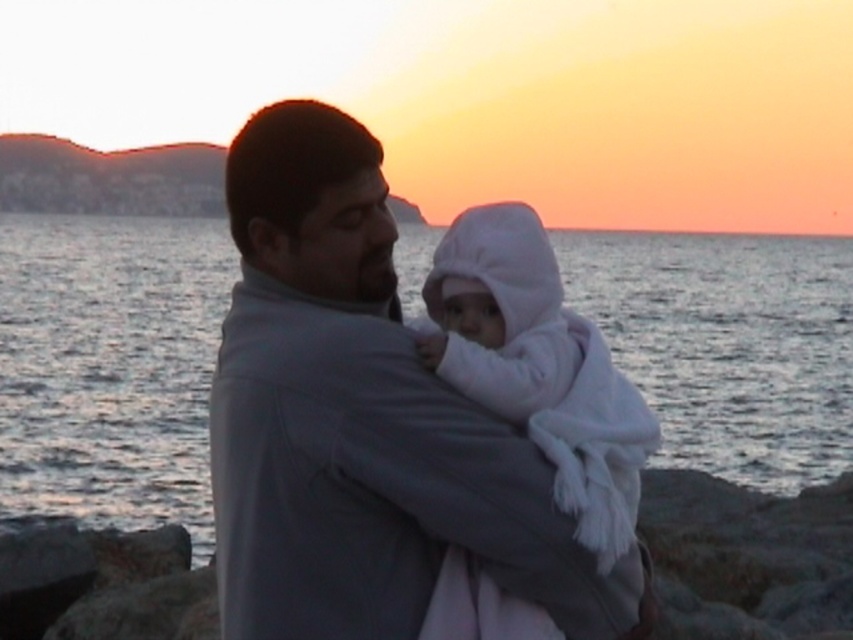
In order to click on gray fabric jacket at center in this screenshot , I will do `click(361, 420)`.

Looking at this image, is gray fabric jacket at center wider than white fleece baby at center?

Yes.

What do you see at coordinates (361, 420) in the screenshot? I see `gray fabric jacket at center` at bounding box center [361, 420].

Where is `gray fabric jacket at center`? Image resolution: width=853 pixels, height=640 pixels. gray fabric jacket at center is located at coordinates (361, 420).

Is silvery water at center shorter than gray fabric jacket at center?

No, silvery water at center is not shorter than gray fabric jacket at center.

Does silvery water at center have a larger size compared to gray fabric jacket at center?

Yes.

This screenshot has height=640, width=853. Identify the location of silvery water at center. (109, 365).

Identify the location of silvery water at center. (109, 365).

Can you confirm if silvery water at center is positioned to the left of white fleece baby at center?

Incorrect, silvery water at center is not on the left side of white fleece baby at center.

Does silvery water at center lie in front of white fleece baby at center?

No, silvery water at center is behind white fleece baby at center.

Is point (19, 304) positioned in front of point (479, 384)?

That is False.

Identify the location of silvery water at center. (109, 365).